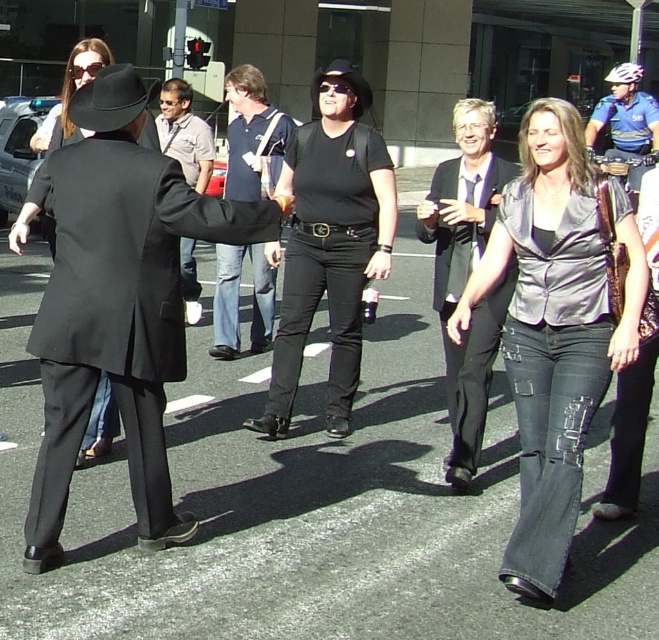
You are a fashion designer observing the group of people in the urban setting. You notice two individuals dressed in matte black clothing on the left side of the image. Which of these two, the matte black suit at left or the matte black coat at left, appears shorter in the scene?

The matte black suit at left is shorter than the matte black coat at left, so the matte black suit at left appears shorter in the scene.